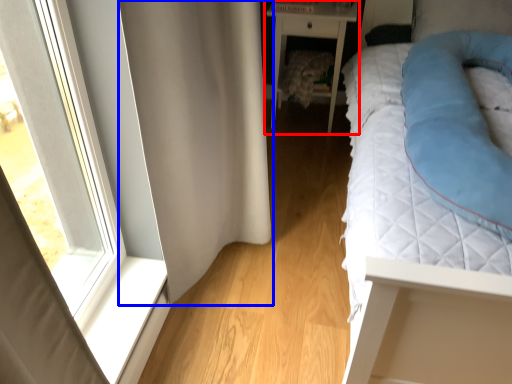
Question: Which point is further to the camera, nightstand (highlighted by a red box) or curtain (highlighted by a blue box)?

Choices:
 (A) nightstand
 (B) curtain

Answer: (A)